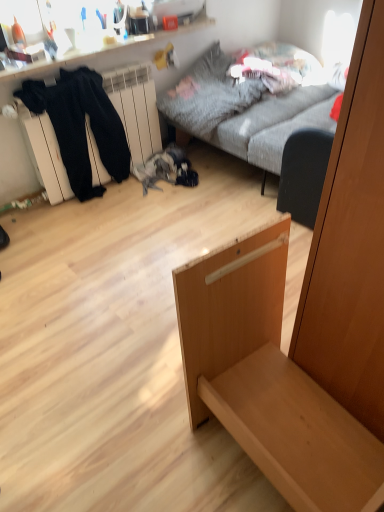
Question: Can black fabric armchair at center be found inside gray fabric couch at upper center?

Choices:
 (A) yes
 (B) no

Answer: (A)

Question: Is gray fabric couch at upper center aimed at black fabric armchair at center?

Choices:
 (A) yes
 (B) no

Answer: (B)

Question: Can you confirm if gray fabric couch at upper center is wider than black fabric armchair at center?

Choices:
 (A) no
 (B) yes

Answer: (B)

Question: Are gray fabric couch at upper center and black fabric armchair at center making contact?

Choices:
 (A) yes
 (B) no

Answer: (B)

Question: Is gray fabric couch at upper center to the left of black fabric armchair at center from the viewer's perspective?

Choices:
 (A) no
 (B) yes

Answer: (A)

Question: Is black fabric armchair at center taller or shorter than gray fabric couch at upper center?

Choices:
 (A) tall
 (B) short

Answer: (B)

Question: Is black fabric armchair at center bigger or smaller than gray fabric couch at upper center?

Choices:
 (A) small
 (B) big

Answer: (A)

Question: Is black fabric armchair at center to the left or to the right of gray fabric couch at upper center in the image?

Choices:
 (A) left
 (B) right

Answer: (A)

Question: In the image, is black fabric armchair at center positioned in front of or behind gray fabric couch at upper center?

Choices:
 (A) behind
 (B) front

Answer: (A)

Question: Is gray fabric couch at upper center in front of or behind black fabric armchair at center in the image?

Choices:
 (A) front
 (B) behind

Answer: (A)

Question: Does point (221, 130) appear closer or farther from the camera than point (317, 166)?

Choices:
 (A) farther
 (B) closer

Answer: (A)

Question: Considering the positions of gray fabric couch at upper center and black fabric armchair at center in the image, is gray fabric couch at upper center wider or thinner than black fabric armchair at center?

Choices:
 (A) thin
 (B) wide

Answer: (B)

Question: From a real-world perspective, is gray fabric couch at upper center above or below black fabric armchair at center?

Choices:
 (A) above
 (B) below

Answer: (A)

Question: Based on their positions, is light wood drawer at center located to the left or right of gray fabric couch at upper center?

Choices:
 (A) right
 (B) left

Answer: (B)

Question: In terms of size, does light wood drawer at center appear bigger or smaller than gray fabric couch at upper center?

Choices:
 (A) big
 (B) small

Answer: (B)